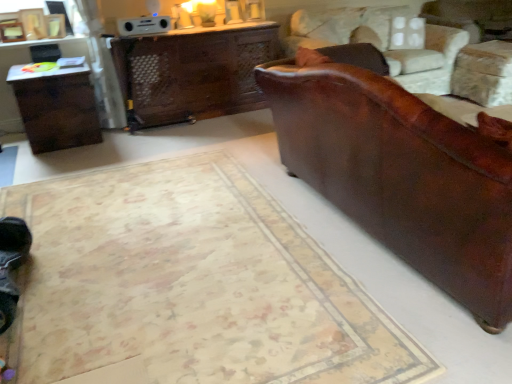
In order to click on free space in front of dark brown wood table at left in this screenshot , I will do `click(52, 162)`.